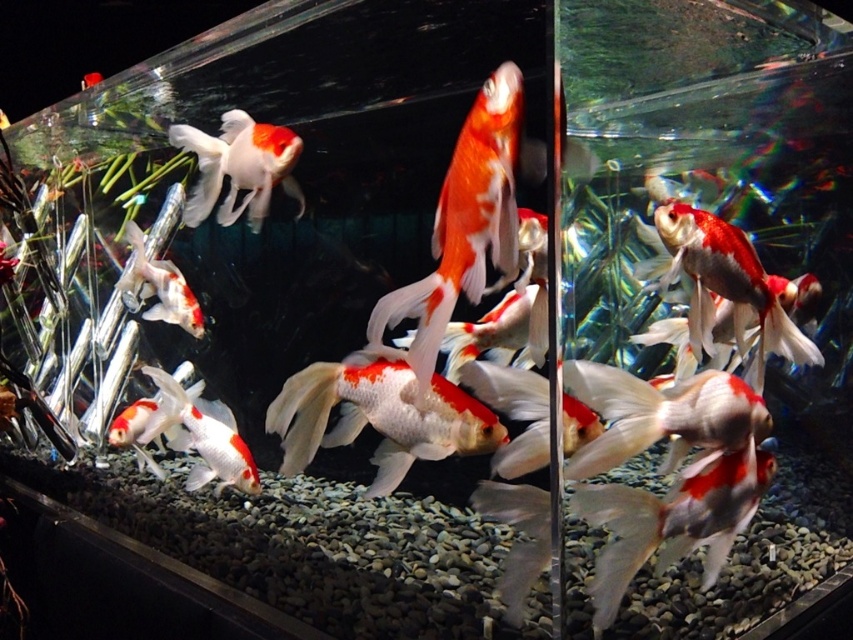
Does shiny orange and white fish at center have a greater height compared to shiny orange and white goldfish at upper left?

Yes, shiny orange and white fish at center is taller than shiny orange and white goldfish at upper left.

Between shiny orange and white fish at center and shiny orange and white goldfish at upper left, which one is positioned higher?

shiny orange and white goldfish at upper left

Identify the location of shiny orange and white fish at center. (463, 221).

At what (x,y) coordinates should I click in order to perform the action: click on shiny orange and white fish at center. Please return your answer as a coordinate pair (x, y). Looking at the image, I should click on (463, 221).

Which is more to the left, shiny orange and white fish at center or shiny metallic goldfish at center?

Positioned to the left is shiny orange and white fish at center.

Is point (471, 244) closer to camera compared to point (740, 342)?

Yes, point (471, 244) is in front of point (740, 342).

You are a GUI agent. You are given a task and a screenshot of the screen. Output one action in this format:
    pyautogui.click(x=<x>, y=<y>)
    Task: Click on the shiny orange and white fish at center
    This screenshot has width=853, height=640.
    Given the screenshot: What is the action you would take?
    pyautogui.click(x=463, y=221)

Does shiny metallic goldfish at center have a greater width compared to shiny orange and white goldfish at upper left?

No, shiny metallic goldfish at center is not wider than shiny orange and white goldfish at upper left.

Locate an element on the screen. The image size is (853, 640). shiny metallic goldfish at center is located at coordinates (726, 285).